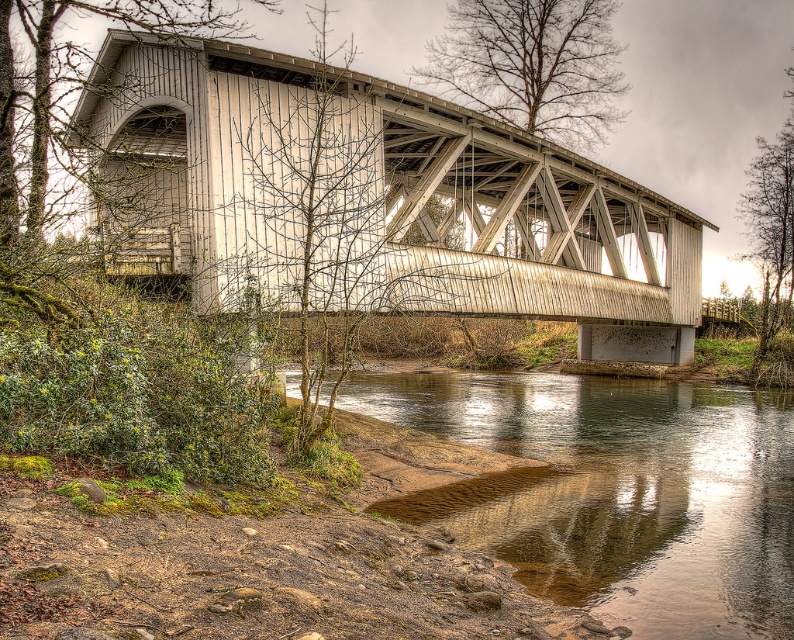
Is white wooden bridge at center wider than brown sedimentary river at lower center?

Indeed, white wooden bridge at center has a greater width compared to brown sedimentary river at lower center.

Can you confirm if white wooden bridge at center is positioned to the right of brown sedimentary river at lower center?

Incorrect, white wooden bridge at center is not on the right side of brown sedimentary river at lower center.

Find the location of `white wooden bridge at center`. white wooden bridge at center is located at coordinates 384,196.